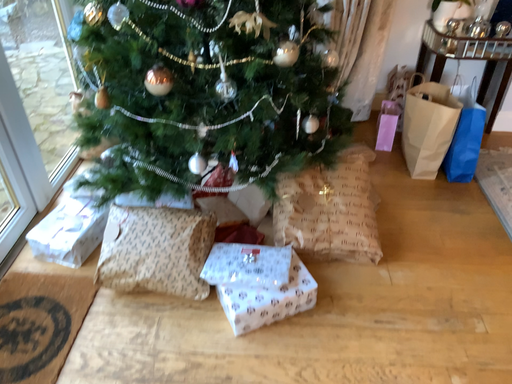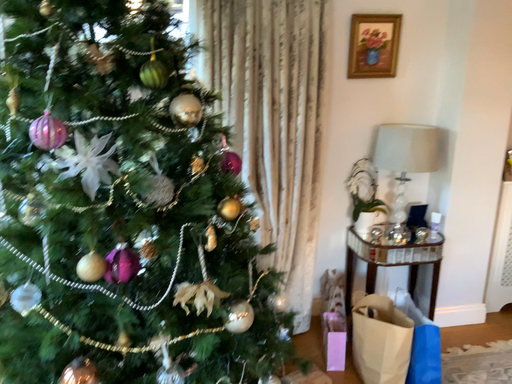
Question: How did the camera likely rotate when shooting the video?

Choices:
 (A) rotated right
 (B) rotated left

Answer: (A)